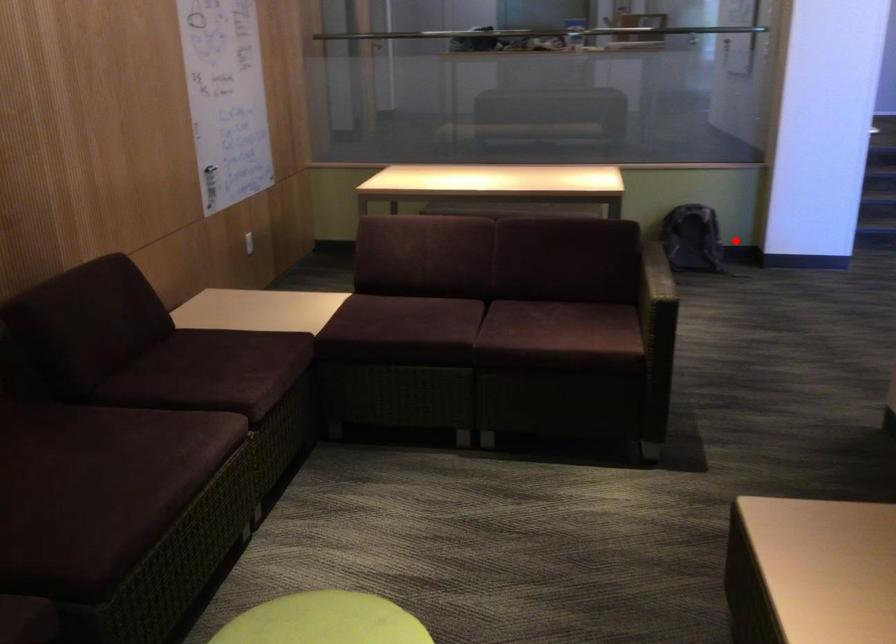
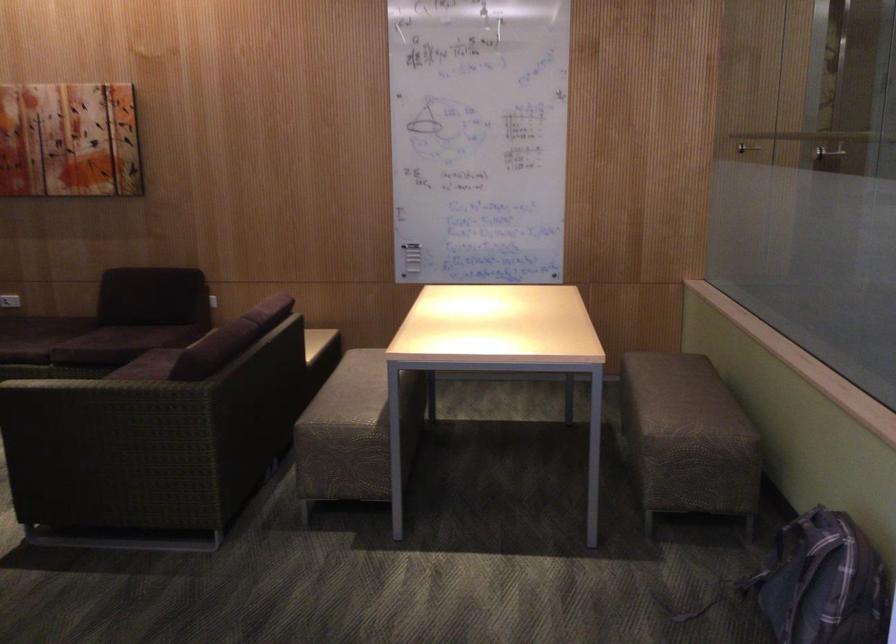
Question: I am providing you with two images of the same scene from different viewpoints. In image1, a red point is highlighted. Considering the same 3D point in image2, which of the following is correct?

Choices:
 (A) It is closer
 (B) It is farther

Answer: (A)